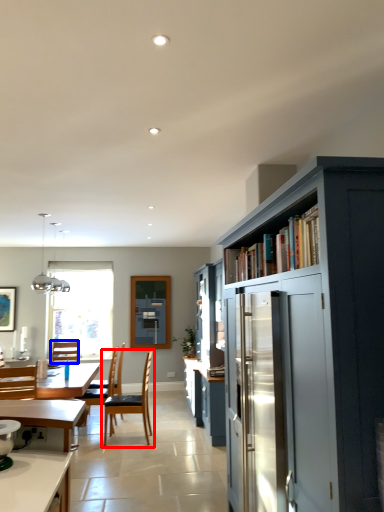
Question: Among these objects, which one is nearest to the camera, chair (highlighted by a red box) or chair (highlighted by a blue box)?

Choices:
 (A) chair
 (B) chair

Answer: (A)